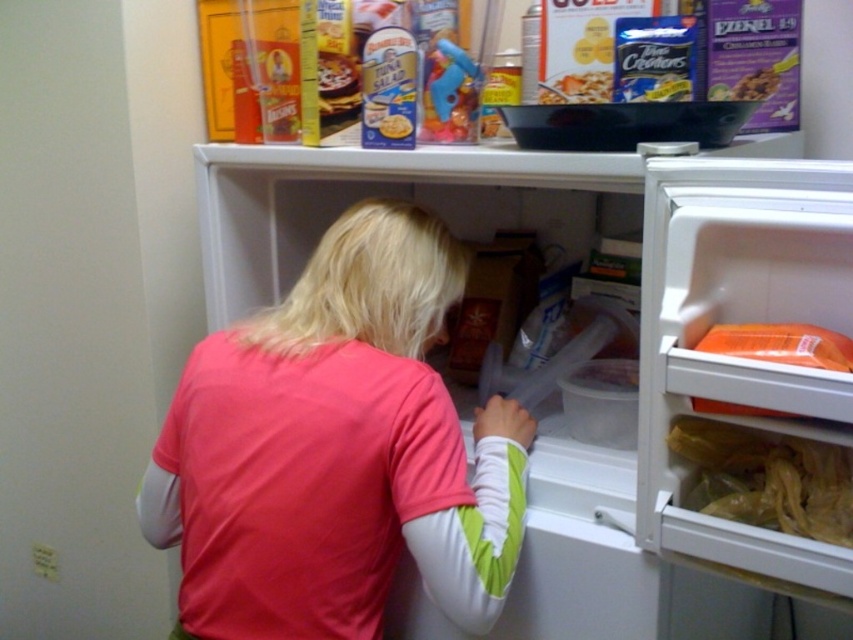
You are a delivery person who needs to place a new item between the pink fabric shirt at center and the matte plastic bowl at upper center. Where should you place it?

The new item should be placed between the pink fabric shirt at center and the matte plastic bowl at upper center, to the right of the pink fabric shirt at center and to the left of the matte plastic bowl at upper center since the pink fabric shirt at center is to the left of the matte plastic bowl at upper center.

You are standing in the kitchen and want to grab the translucent plastic bag at lower right from the white plastic fridge at center. Can you reach it without moving closer to the fridge?

The white plastic fridge at center is closer to the viewer than the translucent plastic bag at lower right, so you would need to move further away from the fridge to reach the translucent plastic bag at lower right.

Based on the photo, you are organizing items in the kitchen and need to place the translucent plastic bag at lower right. Since the white plastic fridge at center is in the way, can you move the bag to the left side of the fridge?

The white plastic fridge at center is positioned over the translucent plastic bag at lower right, so you cannot move the bag to the left side of the fridge without moving the fridge first.